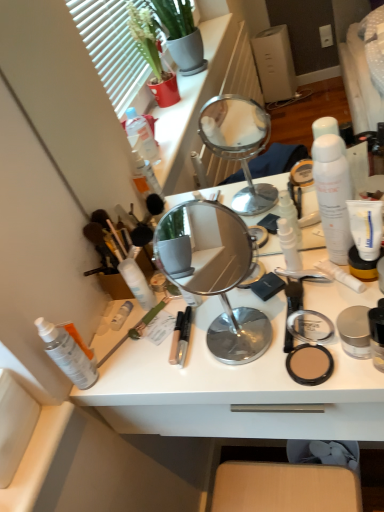
The image size is (384, 512). I want to click on vacant area that lies between polished silver mirror at center and green matte brush at center, so click(168, 339).